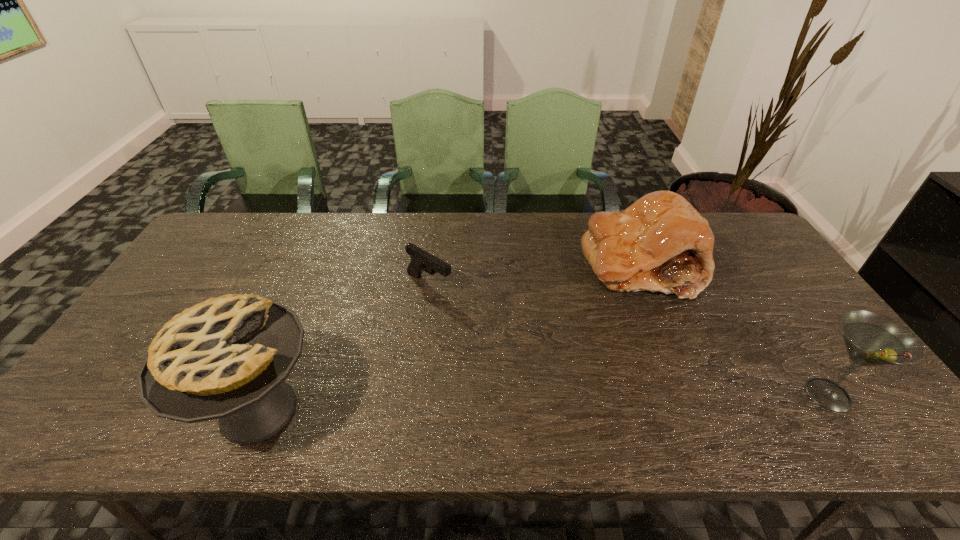
Locate an element on the screen. The height and width of the screenshot is (540, 960). free space between the second object from left to right and the leftmost object is located at coordinates (344, 347).

Where is `free space between the pie and the second object from right to left`? free space between the pie and the second object from right to left is located at coordinates (449, 338).

Where is `unoccupied area between the leftmost object and the rightmost object`? The width and height of the screenshot is (960, 540). unoccupied area between the leftmost object and the rightmost object is located at coordinates (543, 403).

The image size is (960, 540). Identify the location of object that is the third closest to the leftmost object. (871, 339).

Identify which object is the nearest to the shortest object. Please provide its 2D coordinates. Your answer should be formatted as a tuple, i.e. [(x, y)], where the tuple contains the x and y coordinates of a point satisfying the conditions above.

[(226, 358)]